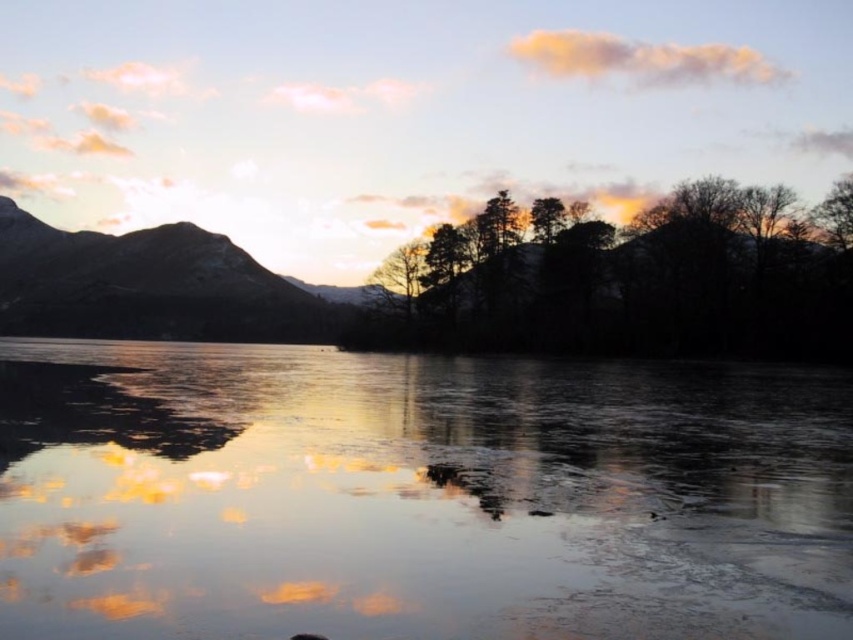
Is translucent ice at center wider than smooth brown mountain at left?

No, translucent ice at center is not wider than smooth brown mountain at left.

Can you confirm if translucent ice at center is taller than smooth brown mountain at left?

Incorrect, translucent ice at center's height is not larger of smooth brown mountain at left's.

Is point (210, 390) in front of point (236, 278)?

That is True.

Where is `translucent ice at center`? translucent ice at center is located at coordinates (416, 496).

Measure the distance between translucent ice at center and camera.

The distance of translucent ice at center from camera is 9.25 meters.

Between point (627, 419) and point (849, 177), which one is positioned behind?

Point (849, 177)

This screenshot has height=640, width=853. Describe the element at coordinates (416, 496) in the screenshot. I see `translucent ice at center` at that location.

Find the location of a particular element. translucent ice at center is located at coordinates (416, 496).

Who is more forward, (427, 552) or (766, 237)?

Result: Point (427, 552) is in front.

Which is above, translucent ice at center or silhouette trees at center?

Positioned higher is silhouette trees at center.

Where is `translucent ice at center`? translucent ice at center is located at coordinates (416, 496).

This screenshot has width=853, height=640. Identify the location of translucent ice at center. (416, 496).